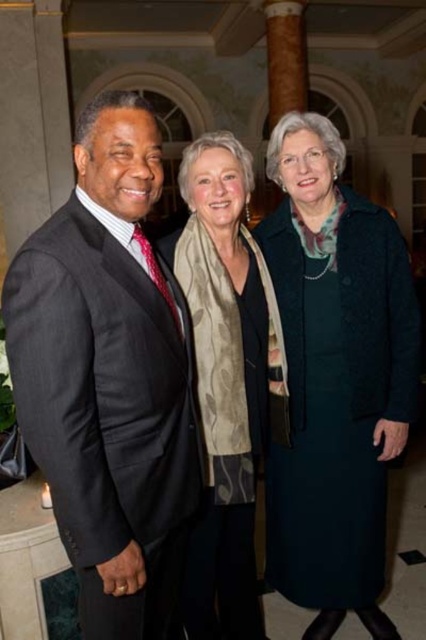
Question: Which object is farther from the camera taking this photo?

Choices:
 (A) matte black suit at left
 (B) beige floral scarf at center

Answer: (B)

Question: Which of the following is the farthest from the observer?

Choices:
 (A) (187, 157)
 (B) (120, 461)
 (C) (327, 364)

Answer: (C)

Question: Can you confirm if matte black suit at left is bigger than dark green wool coat at center?

Choices:
 (A) yes
 (B) no

Answer: (A)

Question: Is dark green wool coat at center closer to the viewer compared to beige floral scarf at center?

Choices:
 (A) no
 (B) yes

Answer: (A)

Question: Which point is closer to the camera?

Choices:
 (A) (310, 419)
 (B) (172, 433)
 (C) (203, 572)

Answer: (B)

Question: Considering the relative positions of dark green wool coat at center and beige floral scarf at center in the image provided, where is dark green wool coat at center located with respect to beige floral scarf at center?

Choices:
 (A) below
 (B) above

Answer: (B)